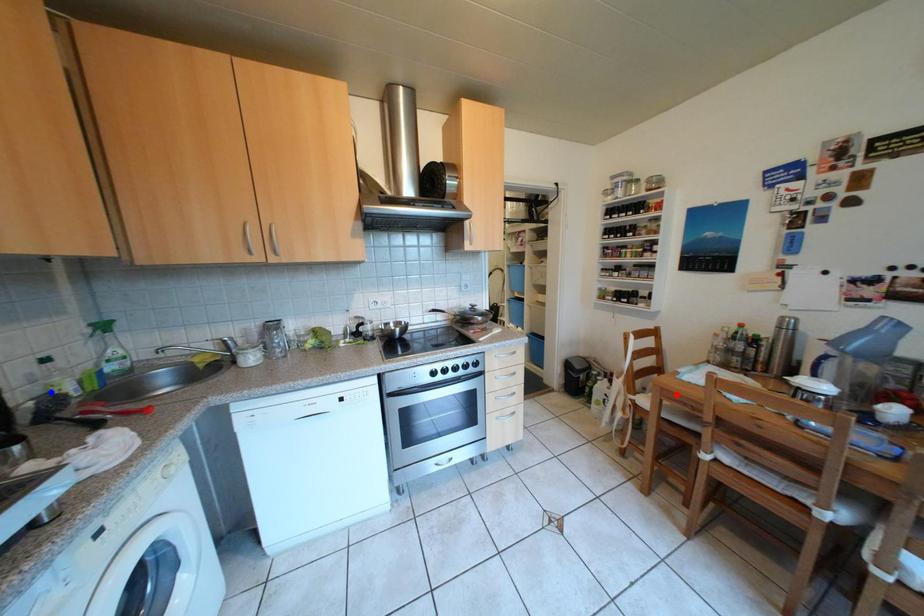
Question: In the image, two points are highlighted. Which point is nearer to the camera? Reply with the corresponding letter.

Choices:
 (A) blue point
 (B) red point

Answer: (A)